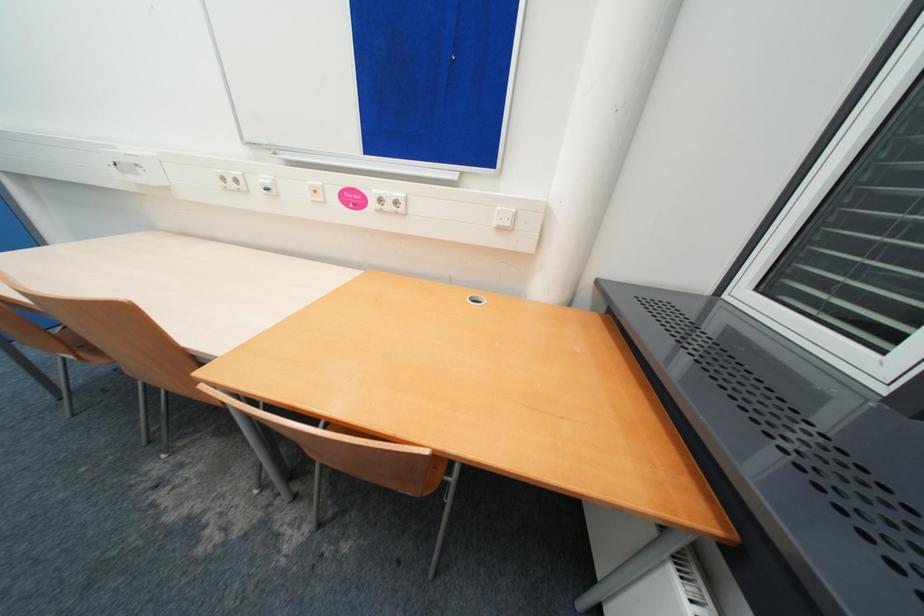
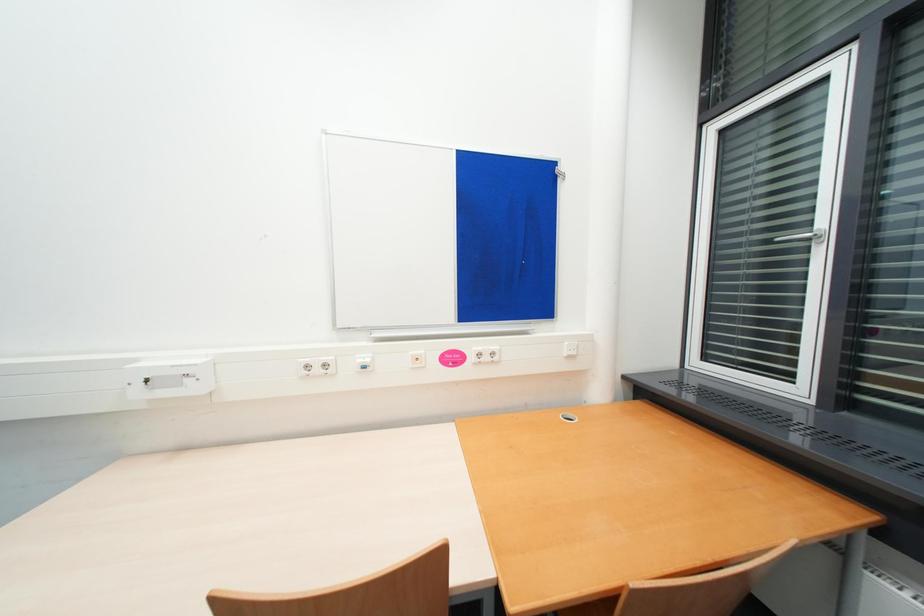
Based on the continuous images, in which direction is the camera rotating?

The camera rotated toward right-up.